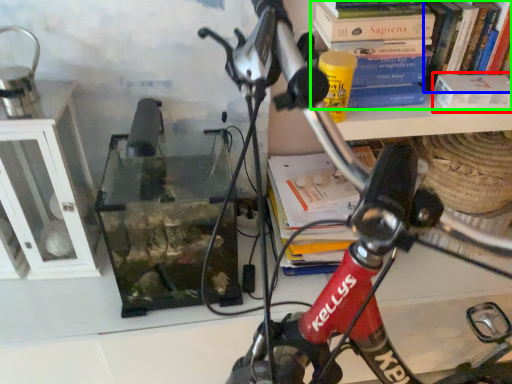
Question: Which object is positioned farthest from paperback book (highlighted by a red box)? Select from book (highlighted by a blue box) and book (highlighted by a green box).

Choices:
 (A) book
 (B) book

Answer: (B)